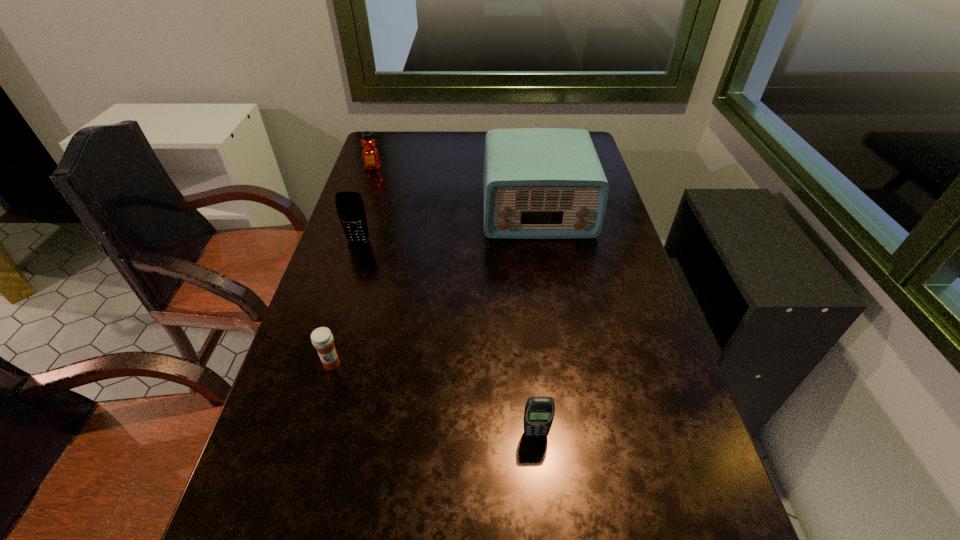
Find the location of a particular element. The height and width of the screenshot is (540, 960). vacant space positioned 0.160m on the front label of the honey is located at coordinates (363, 198).

You are a GUI agent. You are given a task and a screenshot of the screen. Output one action in this format:
    pyautogui.click(x=<x>, y=<y>)
    Task: Click on the vacant space located 0.070m on the screen of the shorter cellular telephone
    Image resolution: width=960 pixels, height=540 pixels.
    Given the screenshot: What is the action you would take?
    pyautogui.click(x=540, y=475)

Where is `free space located on the label side of the medicine`? This screenshot has width=960, height=540. free space located on the label side of the medicine is located at coordinates (310, 440).

Locate an element on the screen. The image size is (960, 540). cellular telephone at the left edge is located at coordinates (350, 208).

Where is `honey that is at the left edge`? honey that is at the left edge is located at coordinates (370, 156).

This screenshot has width=960, height=540. I want to click on medicine that is at the left edge, so click(x=322, y=339).

Locate an element on the screen. The height and width of the screenshot is (540, 960). object situated at the right edge is located at coordinates (539, 183).

Image resolution: width=960 pixels, height=540 pixels. Identify the location of free space at the far edge of the desktop. (451, 158).

This screenshot has width=960, height=540. What are the coordinates of `free space at the left edge` in the screenshot? It's located at (350, 263).

This screenshot has height=540, width=960. I want to click on vacant space at the right edge, so click(x=607, y=230).